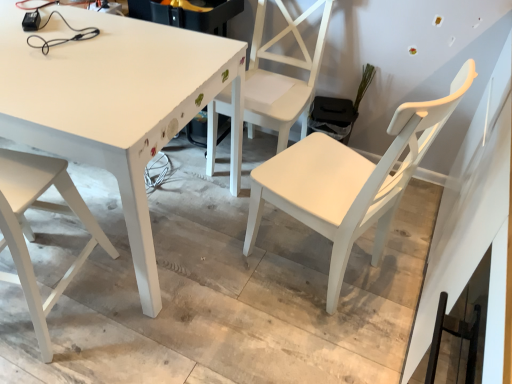
Measure the distance between white matte chair at center, arranged as the second chair when viewed from the right, and camera.

white matte chair at center, arranged as the second chair when viewed from the right, is 1.89 meters away from camera.

What is the approximate height of white matte chair at center, the second chair viewed from the left?

90.95 centimeters.

How much space does white matte chair at lower left, marked as the first chair in a left-to-right arrangement, occupy horizontally?

It is 20.37 inches.

Locate an element on the screen. The width and height of the screenshot is (512, 384). white matte chair at center, which is the 3th chair from left to right is located at coordinates (350, 181).

Consider the image. Considering the sizes of objects white matte chair at center, arranged as the second chair when viewed from the right, and white matte chair at center, which is the 3th chair from left to right, in the image provided, who is smaller, white matte chair at center, arranged as the second chair when viewed from the right, or white matte chair at center, which is the 3th chair from left to right,?

Smaller between the two is white matte chair at center, arranged as the second chair when viewed from the right.

Based on the photo, from the image's perspective, does white matte chair at center, arranged as the second chair when viewed from the right, appear higher than white matte chair at center, which is the 3th chair from left to right?

Yes.

Considering the sizes of objects white matte chair at center, the second chair viewed from the left, and white matte chair at center, which appears as the 1th chair when viewed from the right, in the image provided, who is taller, white matte chair at center, the second chair viewed from the left, or white matte chair at center, which appears as the 1th chair when viewed from the right,?

white matte chair at center, the second chair viewed from the left.

From a real-world perspective, is white matte chair at center, arranged as the second chair when viewed from the right, positioned over white matte chair at center, which is the 3th chair from left to right, based on gravity?

Actually, white matte chair at center, arranged as the second chair when viewed from the right, is physically below white matte chair at center, which is the 3th chair from left to right, in the real world.

Between white painted wood table at center and white matte chair at center, which appears as the 1th chair when viewed from the right, which one has smaller width?

Thinner between the two is white matte chair at center, which appears as the 1th chair when viewed from the right.

In the scene shown: Is white painted wood table at center in front of white matte chair at center, which appears as the 1th chair when viewed from the right?

No, it is not.

Is white painted wood table at center taller than white matte chair at center, which is the 3th chair from left to right?

In fact, white painted wood table at center may be shorter than white matte chair at center, which is the 3th chair from left to right.

Is white painted wood table at center directly adjacent to white matte chair at center, which is the 3th chair from left to right?

white painted wood table at center is not next to white matte chair at center, which is the 3th chair from left to right, and they're not touching.

Between white matte chair at center, which is the 3th chair from left to right, and white matte chair at center, the second chair viewed from the left, which one appears on the right side from the viewer's perspective?

From the viewer's perspective, white matte chair at center, which is the 3th chair from left to right, appears more on the right side.

Is white matte chair at center, which is the 3th chair from left to right, completely or partially outside of white matte chair at center, arranged as the second chair when viewed from the right?

white matte chair at center, which is the 3th chair from left to right, is positioned outside white matte chair at center, arranged as the second chair when viewed from the right.

From the image's perspective, count 1st chairs downward from the white matte chair at center, the second chair viewed from the left, and point to it. Please provide its 2D coordinates.

[(350, 181)]

Does white painted wood table at center have a greater width compared to white matte chair at center, the second chair viewed from the left?

Yes.

Can you confirm if white painted wood table at center is taller than white matte chair at center, the second chair viewed from the left?

No, white painted wood table at center is not taller than white matte chair at center, the second chair viewed from the left.

Is white painted wood table at center inside or outside of white matte chair at center, the second chair viewed from the left?

The correct answer is: outside.

Can you tell me how much white painted wood table at center and white matte chair at center, arranged as the second chair when viewed from the right, differ in facing direction?

There is a 3.49-degree angle between the facing directions of white painted wood table at center and white matte chair at center, arranged as the second chair when viewed from the right.

Considering the points (309, 165) and (23, 200), which point is in front, point (309, 165) or point (23, 200)?

The point (23, 200) is closer.

Identify the location of chair that is the 2nd one when counting leftward from the white matte chair at center, which appears as the 1th chair when viewed from the right. The image size is (512, 384). (33, 233).

Is white matte chair at center, which appears as the 1th chair when viewed from the right, outside of white matte chair at lower left, marked as the first chair in a left-to-right arrangement?

Yes.

From the image's perspective, would you say white matte chair at center, which appears as the 1th chair when viewed from the right, is shown under white matte chair at lower left, marked as the first chair in a left-to-right arrangement?

Actually, white matte chair at center, which appears as the 1th chair when viewed from the right, appears above white matte chair at lower left, marked as the first chair in a left-to-right arrangement, in the image.

Can you confirm if white painted wood table at center is smaller than white matte chair at lower left, marked as the first chair in a left-to-right arrangement?

Actually, white painted wood table at center might be larger than white matte chair at lower left, marked as the first chair in a left-to-right arrangement.

Can you confirm if white painted wood table at center is shorter than white matte chair at lower left, placed as the third chair when sorted from right to left?

Correct, white painted wood table at center is not as tall as white matte chair at lower left, placed as the third chair when sorted from right to left.

Identify the location of table below the white matte chair at lower left, marked as the first chair in a left-to-right arrangement (from a real-world perspective). (117, 105).

Can you confirm if white painted wood table at center is positioned to the left of white matte chair at lower left, placed as the third chair when sorted from right to left?

In fact, white painted wood table at center is to the right of white matte chair at lower left, placed as the third chair when sorted from right to left.

Is white matte chair at lower left, placed as the third chair when sorted from right to left, positioned with its back to white painted wood table at center?

No, white matte chair at lower left, placed as the third chair when sorted from right to left, is not facing the opposite direction of white painted wood table at center.

From the image's perspective, is white matte chair at lower left, placed as the third chair when sorted from right to left, located above or below white painted wood table at center?

Based on their image positions, white matte chair at lower left, placed as the third chair when sorted from right to left, is located beneath white painted wood table at center.

In order to click on table that appears on the right of white matte chair at lower left, marked as the first chair in a left-to-right arrangement in this screenshot , I will do `click(117, 105)`.

Considering the relative positions of white matte chair at lower left, marked as the first chair in a left-to-right arrangement, and white painted wood table at center in the image provided, is white matte chair at lower left, marked as the first chair in a left-to-right arrangement, to the right of white painted wood table at center from the viewer's perspective?

In fact, white matte chair at lower left, marked as the first chair in a left-to-right arrangement, is to the left of white painted wood table at center.

The image size is (512, 384). Find the location of `chair on the right side of white matte chair at center, arranged as the second chair when viewed from the right`. chair on the right side of white matte chair at center, arranged as the second chair when viewed from the right is located at coordinates (350, 181).

Locate an element on the screen. The height and width of the screenshot is (384, 512). the 3rd chair positioned above the white painted wood table at center (from a real-world perspective) is located at coordinates (350, 181).

Estimate the real-world distances between objects in this image. Which object is closer to white matte chair at center, which appears as the 1th chair when viewed from the right, white matte chair at center, the second chair viewed from the left, or white matte chair at lower left, marked as the first chair in a left-to-right arrangement?

The object closer to white matte chair at center, which appears as the 1th chair when viewed from the right, is white matte chair at center, the second chair viewed from the left.

Considering their positions, is white matte chair at center, the second chair viewed from the left, positioned further to white painted wood table at center than white matte chair at center, which appears as the 1th chair when viewed from the right?

Among the two, white matte chair at center, which appears as the 1th chair when viewed from the right, is located further to white painted wood table at center.

When comparing their distances from white matte chair at center, which appears as the 1th chair when viewed from the right, does white painted wood table at center or white matte chair at lower left, placed as the third chair when sorted from right to left, seem closer?

white painted wood table at center lies closer to white matte chair at center, which appears as the 1th chair when viewed from the right, than the other object.

Estimate the real-world distances between objects in this image. Which object is further from white matte chair at lower left, marked as the first chair in a left-to-right arrangement, white matte chair at center, which appears as the 1th chair when viewed from the right, or white matte chair at center, the second chair viewed from the left?

white matte chair at center, the second chair viewed from the left, is positioned further to the anchor white matte chair at lower left, marked as the first chair in a left-to-right arrangement.

From the image, which object appears to be nearer to white matte chair at center, the second chair viewed from the left, white painted wood table at center or white matte chair at lower left, marked as the first chair in a left-to-right arrangement?

Among the two, white painted wood table at center is located nearer to white matte chair at center, the second chair viewed from the left.

From the image, which object appears to be farther from white matte chair at center, which appears as the 1th chair when viewed from the right, white matte chair at center, arranged as the second chair when viewed from the right, or white painted wood table at center?

The object further to white matte chair at center, which appears as the 1th chair when viewed from the right, is white painted wood table at center.

When comparing their distances from white matte chair at center, the second chair viewed from the left, does white matte chair at center, which appears as the 1th chair when viewed from the right, or white matte chair at lower left, placed as the third chair when sorted from right to left, seem further?

Among the two, white matte chair at lower left, placed as the third chair when sorted from right to left, is located further to white matte chair at center, the second chair viewed from the left.

Looking at the image, which one is located closer to white matte chair at lower left, marked as the first chair in a left-to-right arrangement, white matte chair at center, arranged as the second chair when viewed from the right, or white painted wood table at center?

The object closer to white matte chair at lower left, marked as the first chair in a left-to-right arrangement, is white painted wood table at center.

This screenshot has width=512, height=384. Find the location of `chair situated between white matte chair at lower left, marked as the first chair in a left-to-right arrangement, and white matte chair at center, which is the 3th chair from left to right, from left to right`. chair situated between white matte chair at lower left, marked as the first chair in a left-to-right arrangement, and white matte chair at center, which is the 3th chair from left to right, from left to right is located at coordinates (282, 76).

Locate an element on the screen. table between white matte chair at lower left, placed as the third chair when sorted from right to left, and white matte chair at center, which appears as the 1th chair when viewed from the right, in the horizontal direction is located at coordinates (117, 105).

Find the location of a particular element. The height and width of the screenshot is (384, 512). chair between white painted wood table at center and white matte chair at center, which appears as the 1th chair when viewed from the right, in the horizontal direction is located at coordinates (282, 76).

Locate an element on the screen. This screenshot has width=512, height=384. table between white matte chair at lower left, placed as the third chair when sorted from right to left, and white matte chair at center, arranged as the second chair when viewed from the right, from left to right is located at coordinates (117, 105).